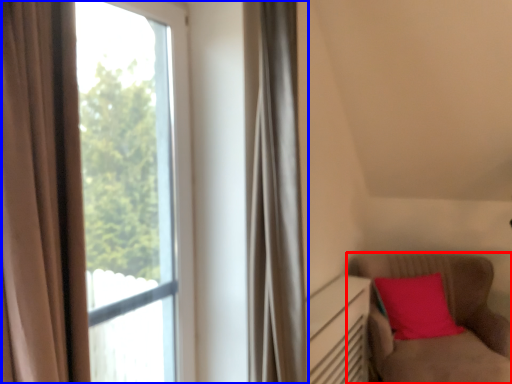
Question: Which of the following is the closest to the observer, furniture (highlighted by a red box) or window (highlighted by a blue box)?

Choices:
 (A) furniture
 (B) window

Answer: (B)